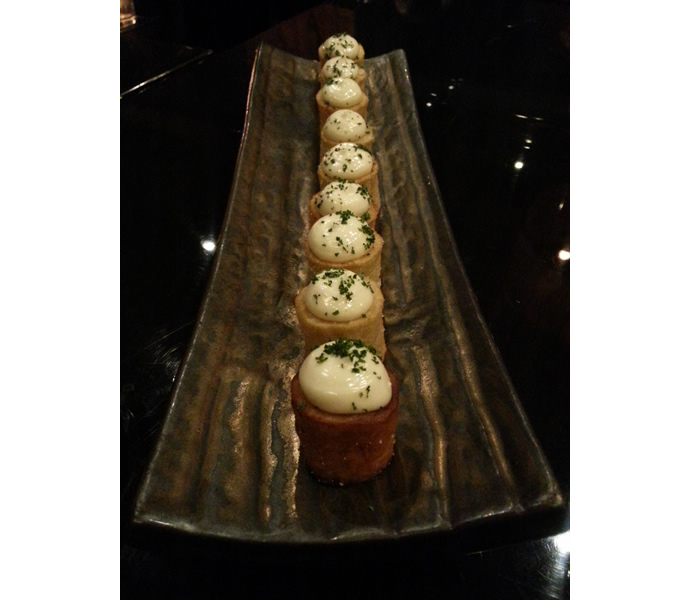
Identify the location of plate. This screenshot has width=690, height=600. coord(243,376).